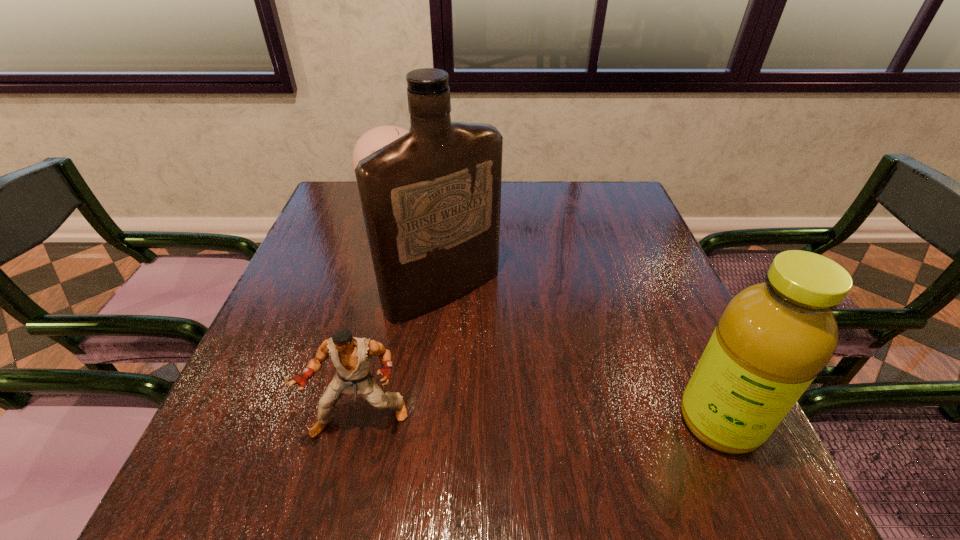
Where is `vacant point located between the puncher and the liquor`? Image resolution: width=960 pixels, height=540 pixels. vacant point located between the puncher and the liquor is located at coordinates (402, 355).

Identify the location of vacant space that is in between the third nearest object and the rightmost object. (581, 356).

Select which object is the closest to the second tallest object. Please provide its 2D coordinates. Your answer should be formatted as a tuple, i.e. [(x, y)], where the tuple contains the x and y coordinates of a point satisfying the conditions above.

[(431, 199)]

Identify which object is located as the nearest to the puncher. Please provide its 2D coordinates. Your answer should be formatted as a tuple, i.e. [(x, y)], where the tuple contains the x and y coordinates of a point satisfying the conditions above.

[(431, 199)]

Image resolution: width=960 pixels, height=540 pixels. Identify the location of free spot that satisfies the following two spatial constraints: 1. on the front-facing side of the fruit juice; 2. on the front label of the puncher. (360, 421).

Locate an element on the screen. This screenshot has width=960, height=540. free spot that satisfies the following two spatial constraints: 1. on the front-facing side of the puncher; 2. on the front label of the rightmost object is located at coordinates (360, 421).

Where is `free spot that satisfies the following two spatial constraints: 1. on the front-facing side of the third shortest object; 2. on the front label of the puncher`? The height and width of the screenshot is (540, 960). free spot that satisfies the following two spatial constraints: 1. on the front-facing side of the third shortest object; 2. on the front label of the puncher is located at coordinates (360, 421).